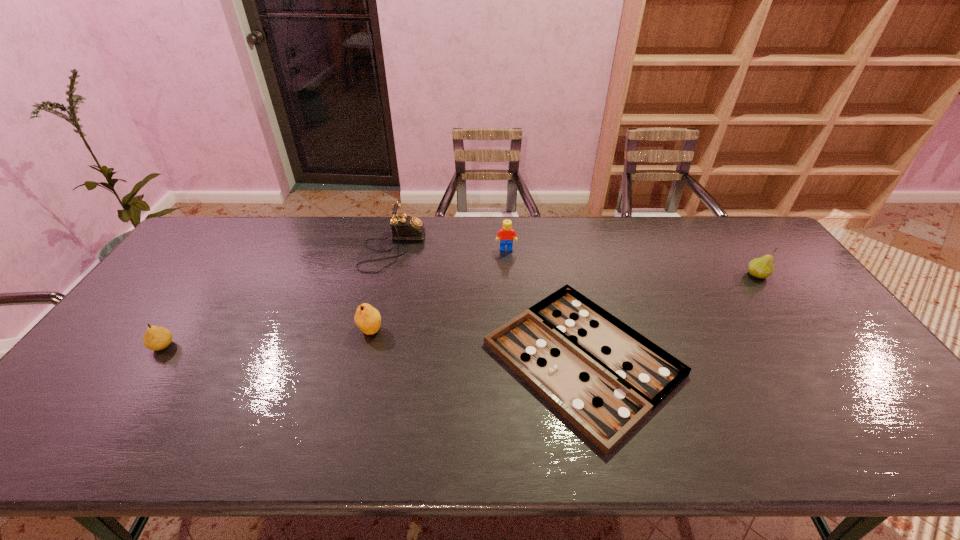
At what (x,y) coordinates should I click in order to perform the action: click on free location at the left edge of the desktop. Please return your answer as a coordinate pair (x, y). Looking at the image, I should click on (204, 275).

I want to click on vacant space at the right edge of the desktop, so click(843, 346).

The height and width of the screenshot is (540, 960). In order to click on vacant area at the far left corner of the desktop in this screenshot , I will do `click(204, 232)`.

This screenshot has height=540, width=960. I want to click on vacant space at the far right corner of the desktop, so click(x=737, y=227).

In order to click on free area in between the rightmost pear and the gameboard in this screenshot , I will do `click(670, 317)`.

What are the coordinates of `empty location between the leftmost pear and the second pear from left to right` in the screenshot? It's located at (267, 338).

Find the location of a particular element. The image size is (960, 540). unoccupied area between the shortest object and the second pear from left to right is located at coordinates click(476, 345).

Identify the location of free space between the Lego and the second pear from left to right. click(438, 289).

Find the location of a particular element. The height and width of the screenshot is (540, 960). free space between the shortest object and the leftmost object is located at coordinates (372, 352).

Where is `empty space between the gameboard and the leftmost object`? empty space between the gameboard and the leftmost object is located at coordinates (372, 352).